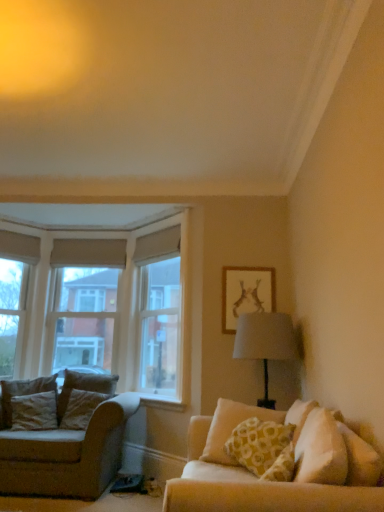
You are a GUI agent. You are given a task and a screenshot of the screen. Output one action in this format:
    pyautogui.click(x=<x>, y=<y>)
    Task: Click on the yellow printed cushion at right, the 1th pillow when ordered from front to back
    The image size is (384, 512).
    Given the screenshot: What is the action you would take?
    pyautogui.click(x=232, y=428)

What do you see at coordinates (81, 409) in the screenshot? The height and width of the screenshot is (512, 384). I see `velvet beige pillow at left, positioned as the 2th pillow in right-to-left order` at bounding box center [81, 409].

What do you see at coordinates (159, 326) in the screenshot?
I see `clear glass window at upper center` at bounding box center [159, 326].

Measure the distance between clear glass window at upper center and camera.

clear glass window at upper center and camera are 4.46 meters apart.

Where is `beige fabric couch at left`? This screenshot has height=512, width=384. beige fabric couch at left is located at coordinates (62, 435).

Considering the relative sizes of beige fabric couch at left and matte gold picture frame at upper right in the image provided, is beige fabric couch at left smaller than matte gold picture frame at upper right?

No.

Considering the relative sizes of beige fabric couch at left and matte gold picture frame at upper right in the image provided, is beige fabric couch at left taller than matte gold picture frame at upper right?

Yes.

Would you say beige fabric couch at left is to the left or to the right of matte gold picture frame at upper right in the picture?

beige fabric couch at left is positioned on matte gold picture frame at upper right's left side.

Is point (52, 449) positioned before point (235, 329)?

Yes.

Find the location of a particular element. the 3rd pillow positioned below the clear glass window at upper center (from the image's perspective) is located at coordinates (34, 412).

Considering the positions of points (155, 306) and (29, 405), is point (155, 306) closer to camera compared to point (29, 405)?

No, it is behind (29, 405).

Considering the relative sizes of clear glass window at upper center and velvet brown pillow at left, positioned as the third pillow in right-to-left order, in the image provided, is clear glass window at upper center shorter than velvet brown pillow at left, positioned as the third pillow in right-to-left order,?

Incorrect, the height of clear glass window at upper center does not fall short of that of velvet brown pillow at left, positioned as the third pillow in right-to-left order.

Looking at this image, from the image's perspective, is clear glass window at upper center located above velvet brown pillow at left, positioned as the 2th pillow in front-to-back order?

Yes, from the image's perspective, clear glass window at upper center is over velvet brown pillow at left, positioned as the 2th pillow in front-to-back order.

Considering the points (228, 412) and (141, 350), which point is in front, point (228, 412) or point (141, 350)?

The point (228, 412) is in front.

Is yellow printed cushion at right, marked as the 1th pillow in a right-to-left arrangement, far from clear glass window at upper center?

Yes.

From the image's perspective, is yellow printed cushion at right, which appears as the 3th pillow when viewed from the left, under clear glass window at upper center?

Indeed, from the image's perspective, yellow printed cushion at right, which appears as the 3th pillow when viewed from the left, is shown beneath clear glass window at upper center.

Is clear glass window at upper center at the back of velvet brown pillow at left, acting as the 2th pillow starting from the back?

velvet brown pillow at left, acting as the 2th pillow starting from the back, is not turned away from clear glass window at upper center.

Is velvet brown pillow at left, positioned as the third pillow in right-to-left order, smaller than clear glass window at upper center?

Correct, velvet brown pillow at left, positioned as the third pillow in right-to-left order, occupies less space than clear glass window at upper center.

Is velvet brown pillow at left, acting as the 2th pillow starting from the back, to the right of clear glass window at upper center from the viewer's perspective?

Incorrect, velvet brown pillow at left, acting as the 2th pillow starting from the back, is not on the right side of clear glass window at upper center.

Is clear glass window at upper center surrounded by velvet brown pillow at left, positioned as the third pillow in right-to-left order?

Definitely not — clear glass window at upper center is not inside velvet brown pillow at left, positioned as the third pillow in right-to-left order.

Considering the relative sizes of velvet brown pillow at left, which is counted as the 1th pillow, starting from the left, and white painted wood at lower center in the image provided, is velvet brown pillow at left, which is counted as the 1th pillow, starting from the left, bigger than white painted wood at lower center?

Yes.

From the image's perspective, would you say velvet brown pillow at left, positioned as the third pillow in right-to-left order, is positioned over white painted wood at lower center?

Yes, from the image's perspective, velvet brown pillow at left, positioned as the third pillow in right-to-left order, is over white painted wood at lower center.

Is velvet brown pillow at left, acting as the 2th pillow starting from the back, in contact with white painted wood at lower center?

No, velvet brown pillow at left, acting as the 2th pillow starting from the back, is not making contact with white painted wood at lower center.

Is velvet brown pillow at left, positioned as the third pillow in right-to-left order, in front of or behind white painted wood at lower center in the image?

In the image, velvet brown pillow at left, positioned as the third pillow in right-to-left order, appears in front of white painted wood at lower center.

Does velvet beige pillow at left, which ranks as the third pillow in front-to-back order, lie in front of beige fabric couch at left?

That is False.

You are a GUI agent. You are given a task and a screenshot of the screen. Output one action in this format:
    pyautogui.click(x=<x>, y=<y>)
    Task: Click on the pillow that is the 2nd one above the beige fabric couch at left (from a real-world perspective)
    
    Given the screenshot: What is the action you would take?
    coord(81,409)

Which of these two, velvet beige pillow at left, the second pillow positioned from the left, or beige fabric couch at left, is thinner?

velvet beige pillow at left, the second pillow positioned from the left, is thinner.

Is velvet beige pillow at left, the 1th pillow positioned from the back, aimed at beige fabric couch at left?

Yes.

Could you tell me if clear glass window at upper center is facing velvet beige pillow at left, the 1th pillow positioned from the back?

Yes, clear glass window at upper center is aimed at velvet beige pillow at left, the 1th pillow positioned from the back.

Find the location of a particular element. window screen lying behind the velvet beige pillow at left, positioned as the 2th pillow in right-to-left order is located at coordinates (159, 326).

Is clear glass window at upper center not within velvet beige pillow at left, which ranks as the third pillow in front-to-back order?

That's correct, clear glass window at upper center is outside of velvet beige pillow at left, which ranks as the third pillow in front-to-back order.

I want to click on studio couch on the left of the matte gold picture frame at upper right, so click(x=62, y=435).

From a real-world perspective, count 3rd pillows downward from the clear glass window at upper center and point to it. Please provide its 2D coordinates.

[(34, 412)]

Considering their positions, is velvet brown pillow at left, acting as the 2th pillow starting from the back, positioned further to matte gold picture frame at upper right than beige fabric couch at left?

velvet brown pillow at left, acting as the 2th pillow starting from the back, is positioned further to the anchor matte gold picture frame at upper right.

Looking at the image, which one is located closer to clear glass window at upper center, beige fabric couch at left or white painted wood at lower center?

white painted wood at lower center lies closer to clear glass window at upper center than the other object.

Looking at the image, which one is located closer to beige fabric couch at left, white painted wood at lower center or yellow printed cushion at right, marked as the 1th pillow in a right-to-left arrangement?

white painted wood at lower center is closer to beige fabric couch at left.

Which object lies further to the anchor point yellow printed cushion at right, the third pillow positioned from the back, velvet beige pillow at left, which ranks as the third pillow in front-to-back order, or white painted wood at lower center?

The object further to yellow printed cushion at right, the third pillow positioned from the back, is velvet beige pillow at left, which ranks as the third pillow in front-to-back order.

When comparing their distances from yellow printed cushion at right, which appears as the 3th pillow when viewed from the left, does white painted wood at lower center or velvet brown pillow at left, which is counted as the 1th pillow, starting from the left, seem closer?

white painted wood at lower center lies closer to yellow printed cushion at right, which appears as the 3th pillow when viewed from the left, than the other object.

Which object lies further to the anchor point velvet beige pillow at left, positioned as the 2th pillow in right-to-left order, white painted wood at lower center or yellow printed cushion at right, marked as the 1th pillow in a right-to-left arrangement?

yellow printed cushion at right, marked as the 1th pillow in a right-to-left arrangement, is further to velvet beige pillow at left, positioned as the 2th pillow in right-to-left order.

From the image, which object appears to be nearer to yellow printed cushion at right, the third pillow positioned from the back, velvet brown pillow at left, positioned as the third pillow in right-to-left order, or white painted wood at lower center?

white painted wood at lower center lies closer to yellow printed cushion at right, the third pillow positioned from the back, than the other object.

Based on their spatial positions, is clear glass window at upper center or yellow printed cushion at right, which appears as the 3th pillow when viewed from the left, closer to velvet brown pillow at left, acting as the 2th pillow starting from the back?

clear glass window at upper center lies closer to velvet brown pillow at left, acting as the 2th pillow starting from the back, than the other object.

At what (x,y) coordinates should I click in order to perform the action: click on window screen located between beige fabric couch at left and yellow printed cushion at right, marked as the 1th pillow in a right-to-left arrangement, in the left-right direction. Please return your answer as a coordinate pair (x, y). Looking at the image, I should click on (159, 326).

You are a GUI agent. You are given a task and a screenshot of the screen. Output one action in this format:
    pyautogui.click(x=<x>, y=<y>)
    Task: Click on the window sill located between beige fabric couch at left and yellow printed cushion at right, the 1th pillow when ordered from front to back, in the left-right direction
    This screenshot has height=512, width=384.
    Given the screenshot: What is the action you would take?
    pyautogui.click(x=161, y=402)

Where is `pillow between velvet beige pillow at left, positioned as the 2th pillow in right-to-left order, and matte gold picture frame at upper right from left to right`? pillow between velvet beige pillow at left, positioned as the 2th pillow in right-to-left order, and matte gold picture frame at upper right from left to right is located at coordinates (232, 428).

Image resolution: width=384 pixels, height=512 pixels. I want to click on window sill situated between velvet brown pillow at left, positioned as the 2th pillow in front-to-back order, and yellow printed cushion at right, the third pillow positioned from the back, from left to right, so click(x=161, y=402).